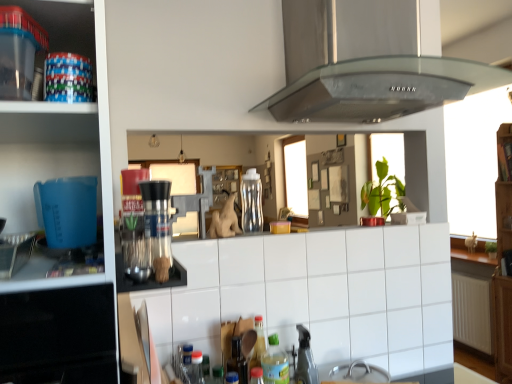
Question: Is satin silver coffee machine at center a part of white tile at center?

Choices:
 (A) yes
 (B) no

Answer: (B)

Question: From a real-world perspective, is white tile at center positioned under satin silver coffee machine at center based on gravity?

Choices:
 (A) no
 (B) yes

Answer: (B)

Question: Does white tile at center have a smaller size compared to satin silver coffee machine at center?

Choices:
 (A) no
 (B) yes

Answer: (A)

Question: Is white tile at center positioned beyond the bounds of satin silver coffee machine at center?

Choices:
 (A) no
 (B) yes

Answer: (B)

Question: Could you tell me if white tile at center is facing satin silver coffee machine at center?

Choices:
 (A) no
 (B) yes

Answer: (A)

Question: Based on their sizes in the image, would you say white tile at center is bigger or smaller than translucent plastic bottle at lower center, placed as the first bottle when sorted from bottom to top?

Choices:
 (A) big
 (B) small

Answer: (A)

Question: Choose the correct answer: Is white tile at center inside translucent plastic bottle at lower center, which is the 1th bottle from front to back, or outside it?

Choices:
 (A) inside
 (B) outside

Answer: (B)

Question: From the image's perspective, relative to translucent plastic bottle at lower center, which is the 1th bottle from front to back, is white tile at center above or below?

Choices:
 (A) above
 (B) below

Answer: (A)

Question: Is white tile at center taller or shorter than translucent plastic bottle at lower center, the 2th bottle positioned from the back?

Choices:
 (A) tall
 (B) short

Answer: (A)

Question: Looking at the image, does transparent plastic bottle at center, marked as the second bottle in a front-to-back arrangement, seem bigger or smaller compared to metallic silver faucet at lower center?

Choices:
 (A) big
 (B) small

Answer: (A)

Question: In the image, is transparent plastic bottle at center, marked as the 1th bottle in a top-to-bottom arrangement, positioned in front of or behind metallic silver faucet at lower center?

Choices:
 (A) front
 (B) behind

Answer: (B)

Question: From a real-world perspective, relative to metallic silver faucet at lower center, is transparent plastic bottle at center, which is counted as the 1th bottle, starting from the back, vertically above or below?

Choices:
 (A) above
 (B) below

Answer: (A)

Question: Is point (251, 183) positioned closer to the camera than point (311, 357)?

Choices:
 (A) closer
 (B) farther

Answer: (B)

Question: Is transparent plastic containers at upper left to the left or to the right of white tile at center in the image?

Choices:
 (A) left
 (B) right

Answer: (A)

Question: Is transparent plastic containers at upper left taller or shorter than white tile at center?

Choices:
 (A) tall
 (B) short

Answer: (B)